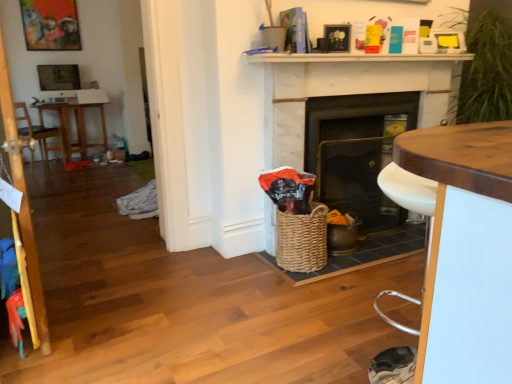
Where is `wooden armchair at left`? The height and width of the screenshot is (384, 512). wooden armchair at left is located at coordinates (34, 129).

What do you see at coordinates (347, 90) in the screenshot? I see `white marble fireplace at center, arranged as the 1th fireplace when viewed from the right` at bounding box center [347, 90].

I want to click on woven brown basket at center, so pos(302,240).

Considering the sizes of matte black fireplace at center, acting as the 2th fireplace starting from the right, and white marble fireplace at upper center in the image, is matte black fireplace at center, acting as the 2th fireplace starting from the right, taller or shorter than white marble fireplace at upper center?

In the image, matte black fireplace at center, acting as the 2th fireplace starting from the right, appears to be taller than white marble fireplace at upper center.

Is matte black fireplace at center, acting as the 2th fireplace starting from the right, bigger than white marble fireplace at upper center?

Indeed, matte black fireplace at center, acting as the 2th fireplace starting from the right, has a larger size compared to white marble fireplace at upper center.

Which object is more forward, matte black fireplace at center, the 1th fireplace positioned from the left, or white marble fireplace at upper center?

Positioned in front is white marble fireplace at upper center.

Is matte black fireplace at center, acting as the 2th fireplace starting from the right, next to white marble fireplace at upper center?

There is a gap between matte black fireplace at center, acting as the 2th fireplace starting from the right, and white marble fireplace at upper center.

From a real-world perspective, which fireplace is the 2nd one underneath the wooden picture frame at upper left? Please provide its 2D coordinates.

[(357, 151)]

From a real-world perspective, is wooden picture frame at upper left located beneath matte black fireplace at center, the 1th fireplace positioned from the left?

No, from a real-world perspective, wooden picture frame at upper left is not beneath matte black fireplace at center, the 1th fireplace positioned from the left.

Considering the sizes of objects wooden picture frame at upper left and matte black fireplace at center, the 1th fireplace positioned from the left, in the image provided, who is smaller, wooden picture frame at upper left or matte black fireplace at center, the 1th fireplace positioned from the left,?

With smaller size is wooden picture frame at upper left.

Find the location of a particular element. The image size is (512, 384). basket below the wooden picture frame at upper left (from the image's perspective) is located at coordinates (302, 240).

Is wooden picture frame at upper left positioned far away from woven brown basket at center?

Absolutely, wooden picture frame at upper left is distant from woven brown basket at center.

Is wooden picture frame at upper left shorter than woven brown basket at center?

No, wooden picture frame at upper left is not shorter than woven brown basket at center.

What's the angular difference between wooden picture frame at upper left and woven brown basket at center's facing directions?

The facing directions of wooden picture frame at upper left and woven brown basket at center are 3.13 degrees apart.

Does woven brown basket at center have a greater width compared to wooden armchair at left?

No.

Is the surface of woven brown basket at center in direct contact with wooden armchair at left?

No.

From the image's perspective, is wooden picture frame at upper left located above or below brown wooden table at left?

From the image's perspective, wooden picture frame at upper left appears above brown wooden table at left.

Which is closer, (26, 45) or (63, 136)?

Point (26, 45).

Could you tell me if wooden picture frame at upper left is facing brown wooden table at left?

No, wooden picture frame at upper left is not oriented towards brown wooden table at left.

Does wooden picture frame at upper left have a lesser height compared to brown wooden table at left?

Indeed, wooden picture frame at upper left has a lesser height compared to brown wooden table at left.

Who is more distant, wooden armchair at left or brown wooden table at left?

brown wooden table at left.

Considering the points (22, 135) and (69, 142), which point is behind, point (22, 135) or point (69, 142)?

The point (69, 142) is more distant.

Considering the sizes of objects wooden armchair at left and brown wooden table at left in the image provided, who is bigger, wooden armchair at left or brown wooden table at left?

With larger size is brown wooden table at left.

Does wooden armchair at left turn towards brown wooden table at left?

Yes, wooden armchair at left is oriented towards brown wooden table at left.

Is matte black fireplace at center, the 1th fireplace positioned from the left, situated inside white glossy desk at center or outside?

matte black fireplace at center, the 1th fireplace positioned from the left, exists outside the volume of white glossy desk at center.

Looking at the image, does matte black fireplace at center, the 1th fireplace positioned from the left, seem bigger or smaller compared to white glossy desk at center?

Clearly, matte black fireplace at center, the 1th fireplace positioned from the left, is larger in size than white glossy desk at center.

Does matte black fireplace at center, acting as the 2th fireplace starting from the right, appear on the left side of white glossy desk at center?

No.

There is a matte black fireplace at center, the 1th fireplace positioned from the left. At what (x,y) coordinates should I click in order to perform the action: click on mantle above it (from a real-world perspective). Please return your answer as a coordinate pair (x, y). Looking at the image, I should click on (x=353, y=58).

This screenshot has width=512, height=384. Identify the location of fireplace that is the 1st object located in front of the wooden picture frame at upper left. (357, 151).

Which object lies nearer to the anchor point matte black fireplace at center, acting as the 2th fireplace starting from the right, white glossy desk at center or wooden picture frame at upper left?

white glossy desk at center is positioned closer to the anchor matte black fireplace at center, acting as the 2th fireplace starting from the right.

Looking at the image, which one is located closer to matte black fireplace at center, acting as the 2th fireplace starting from the right, wooden armchair at left or wooden picture frame at upper left?

wooden armchair at left.

Which object lies further to the anchor point woven brown basket at center, wooden picture frame at upper left or brown wooden table at left?

wooden picture frame at upper left is positioned further to the anchor woven brown basket at center.

Looking at the image, which one is located further to wooden picture frame at upper left, white marble fireplace at center, positioned as the 2th fireplace in left-to-right order, or matte black fireplace at center, acting as the 2th fireplace starting from the right?

Among the two, matte black fireplace at center, acting as the 2th fireplace starting from the right, is located further to wooden picture frame at upper left.

Which object lies nearer to the anchor point wooden picture frame at upper left, wooden armchair at left or matte black fireplace at center, the 1th fireplace positioned from the left?

wooden armchair at left lies closer to wooden picture frame at upper left than the other object.

Considering their positions, is white glossy desk at center positioned closer to wooden armchair at left than wooden picture frame at upper left?

Based on the image, wooden picture frame at upper left appears to be nearer to wooden armchair at left.

When comparing their distances from white marble fireplace at upper center, does white marble fireplace at center, positioned as the 2th fireplace in left-to-right order, or white glossy desk at center seem further?

white glossy desk at center.

Looking at the image, which one is located further to white marble fireplace at center, positioned as the 2th fireplace in left-to-right order, wooden picture frame at upper left or wooden armchair at left?

wooden picture frame at upper left lies further to white marble fireplace at center, positioned as the 2th fireplace in left-to-right order, than the other object.

I want to click on mantle between white glossy desk at center and white marble fireplace at center, arranged as the 1th fireplace when viewed from the right, along the z-axis, so click(x=353, y=58).

This screenshot has height=384, width=512. In order to click on table between wooden armchair at left and woven brown basket at center in the horizontal direction in this screenshot , I will do `click(76, 128)`.

At what (x,y) coordinates should I click in order to perform the action: click on mantle between wooden picture frame at upper left and matte black fireplace at center, acting as the 2th fireplace starting from the right, from left to right. Please return your answer as a coordinate pair (x, y). Looking at the image, I should click on tap(353, 58).

Find the location of a particular element. The image size is (512, 384). mantle between wooden armchair at left and matte black fireplace at center, the 1th fireplace positioned from the left, from left to right is located at coordinates (353, 58).